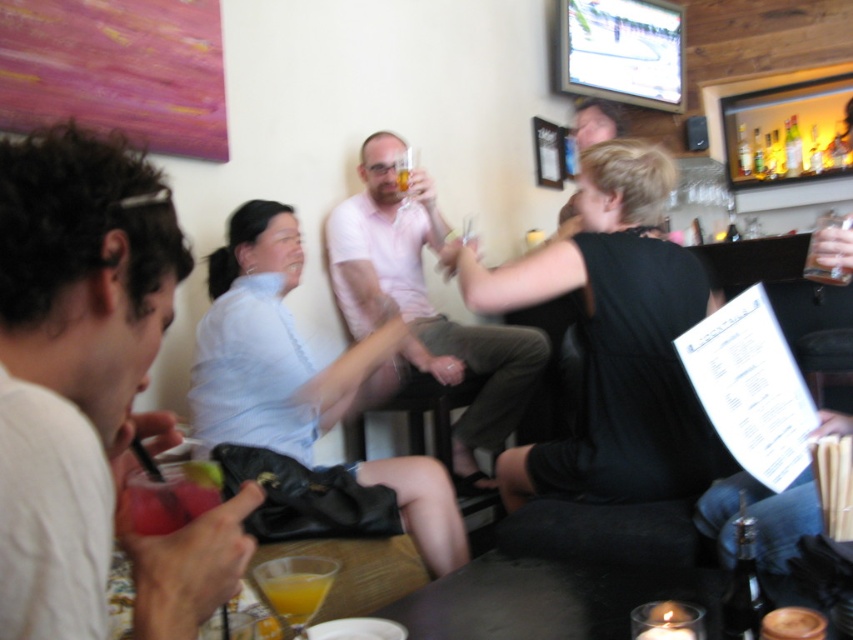
Who is positioned more to the right, white matte shirt at upper left or translucent glass bottles at upper right?

Positioned to the right is translucent glass bottles at upper right.

Who is positioned more to the left, white matte shirt at upper left or translucent glass bottles at upper right?

white matte shirt at upper left

Identify the location of white matte shirt at upper left. (82, 269).

Does light blue shirt at center appear on the left side of translucent glass bottles at upper right?

Yes, light blue shirt at center is to the left of translucent glass bottles at upper right.

Describe the element at coordinates (277, 346) in the screenshot. I see `light blue shirt at center` at that location.

Find the location of `light blue shirt at center`. light blue shirt at center is located at coordinates (277, 346).

Between white matte shirt at upper left and translucent glass at lower center, which one has less height?

translucent glass at lower center

Does white matte shirt at upper left come in front of translucent glass at lower center?

Yes, it is.

Is point (122, 337) farther from camera compared to point (306, 596)?

No, it is not.

At what (x,y) coordinates should I click in order to perform the action: click on white matte shirt at upper left. Please return your answer as a coordinate pair (x, y). Looking at the image, I should click on (82, 269).